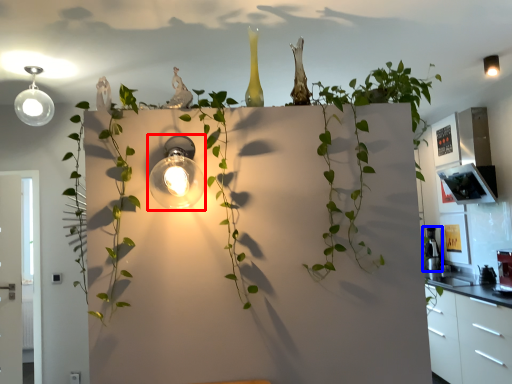
Question: Which point is further to the camera, light fixture (highlighted by a red box) or appliance (highlighted by a blue box)?

Choices:
 (A) light fixture
 (B) appliance

Answer: (B)